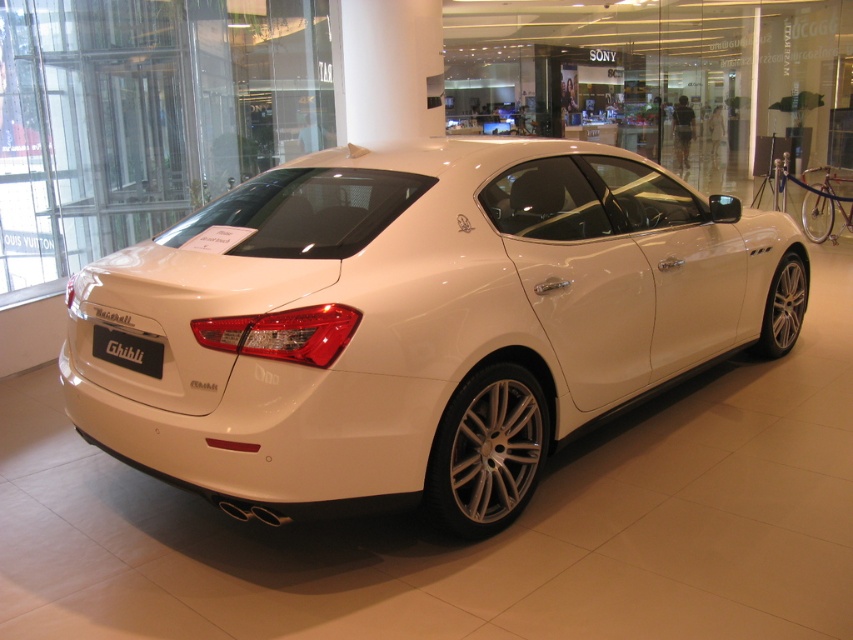
Is white metallic car at center shorter than black matte license plate at rear?

No, white metallic car at center is not shorter than black matte license plate at rear.

Is white metallic car at center closer to the viewer compared to black matte license plate at rear?

Yes, it is.

Locate an element on the screen. The image size is (853, 640). white metallic car at center is located at coordinates (419, 321).